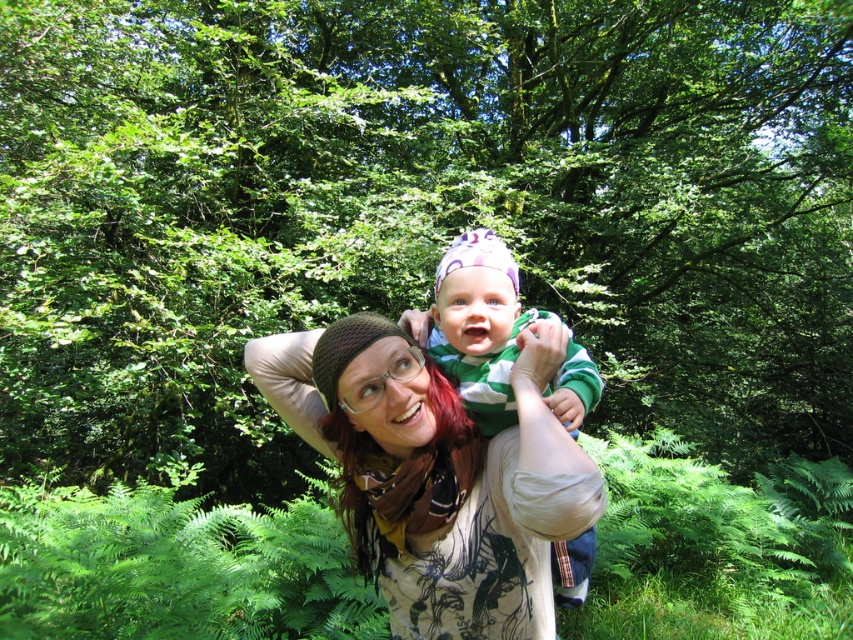
Question: Which point is closer to the camera taking this photo?

Choices:
 (A) (450, 536)
 (B) (544, 397)

Answer: (A)

Question: Can you confirm if matte brown knitted hat at center is thinner than green striped sweater at center?

Choices:
 (A) no
 (B) yes

Answer: (A)

Question: In this image, where is matte brown knitted hat at center located relative to green striped sweater at center?

Choices:
 (A) left
 (B) right

Answer: (A)

Question: Is matte brown knitted hat at center smaller than green striped sweater at center?

Choices:
 (A) no
 (B) yes

Answer: (B)

Question: Which point is closer to the camera?

Choices:
 (A) (569, 410)
 (B) (555, 424)

Answer: (B)